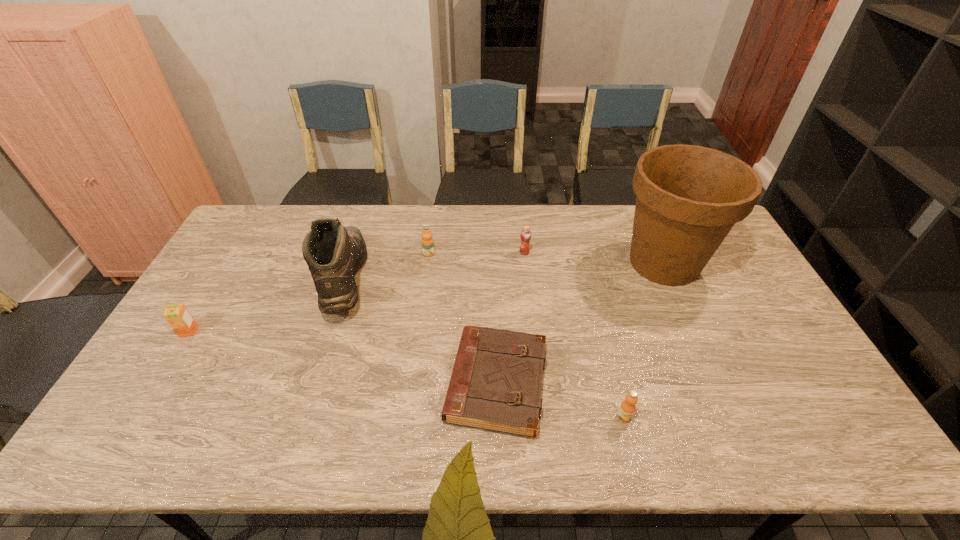
I want to click on the shortest object, so click(x=495, y=385).

The height and width of the screenshot is (540, 960). I want to click on vacant space located 0.320m on the front of the flowerpot, so click(x=721, y=391).

Locate an element on the screen. This screenshot has width=960, height=540. free space located on the left of the sixth shortest object is located at coordinates (207, 279).

The height and width of the screenshot is (540, 960). Identify the location of blank space located on the label of the second orange juice from left to right. (418, 346).

Identify the location of vacant space located 0.190m on the back of the third orange juice from left to right. (520, 217).

Identify the location of vacant space located 0.090m on the right of the leftmost object. The image size is (960, 540). (228, 332).

At what (x,y) coordinates should I click in order to perform the action: click on free location located 0.070m on the front label of the second object from right to left. Please return your answer as a coordinate pair (x, y). The image size is (960, 540). Looking at the image, I should click on (633, 452).

Locate an element on the screen. This screenshot has width=960, height=540. vacant space situated 0.380m on the left of the shortest object is located at coordinates (298, 384).

The image size is (960, 540). What are the coordinates of `flowerpot that is at the far edge` in the screenshot? It's located at (689, 197).

Image resolution: width=960 pixels, height=540 pixels. What are the coordinates of `ski boot that is at the far edge` in the screenshot? It's located at (334, 253).